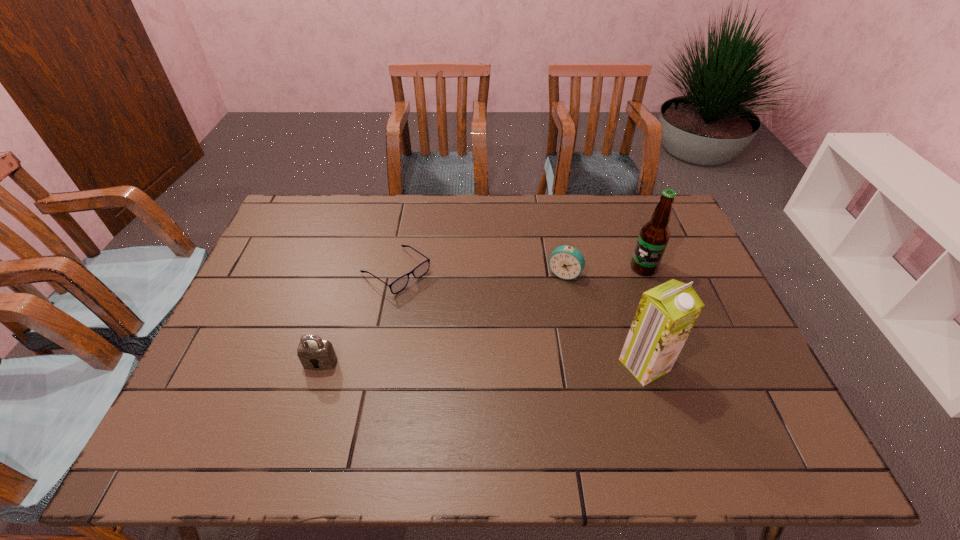
Locate an element on the screen. The image size is (960, 540). free space between the padlock and the third object from right to left is located at coordinates (443, 319).

This screenshot has height=540, width=960. In order to click on vacant space that's between the shortest object and the beer bottle in this screenshot , I will do `click(519, 269)`.

Image resolution: width=960 pixels, height=540 pixels. Identify the location of empty space that is in between the soya milk and the shortest object. (520, 318).

Locate an element on the screen. The image size is (960, 540). free spot between the padlock and the soya milk is located at coordinates (482, 364).

Identify the location of object identified as the second closest to the soya milk. Image resolution: width=960 pixels, height=540 pixels. (654, 235).

The image size is (960, 540). I want to click on object that ranks as the third closest to the third object from right to left, so click(399, 284).

Where is `free spot that satisfies the following two spatial constraints: 1. at the front of the soya milk near the keyhole; 2. on the left side of the padlock`? free spot that satisfies the following two spatial constraints: 1. at the front of the soya milk near the keyhole; 2. on the left side of the padlock is located at coordinates (320, 365).

The height and width of the screenshot is (540, 960). I want to click on free location that satisfies the following two spatial constraints: 1. at the front of the soya milk near the keyhole; 2. on the left side of the padlock, so (320, 365).